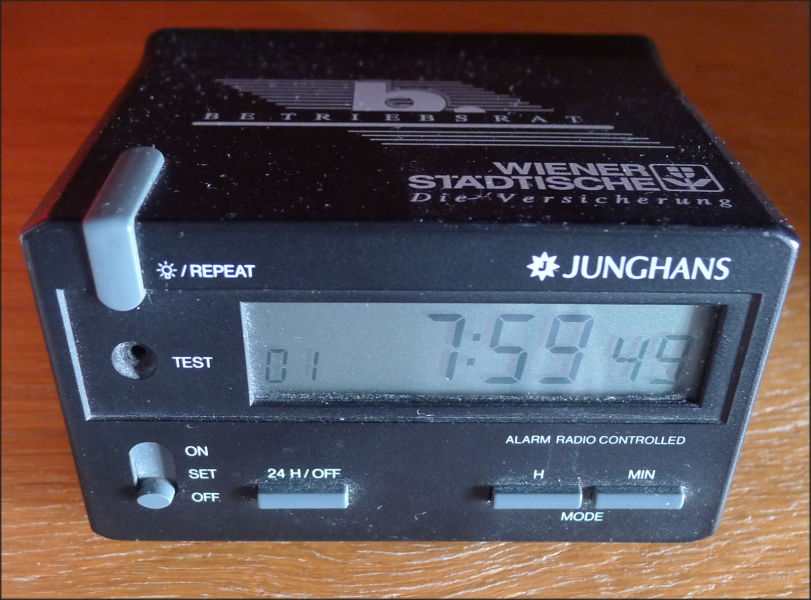
Image resolution: width=811 pixels, height=600 pixels. Identify the location of plug in area. (135, 349).